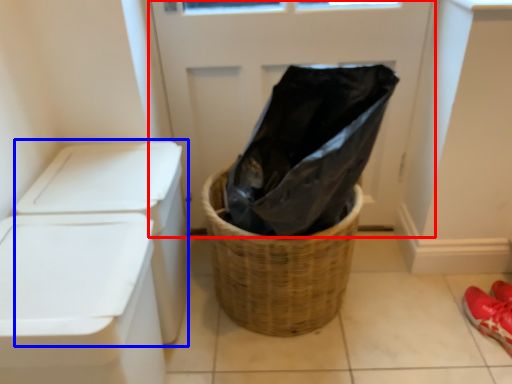
Question: Among these objects, which one is farthest to the camera, screen door (highlighted by a red box) or washer (highlighted by a blue box)?

Choices:
 (A) screen door
 (B) washer

Answer: (A)